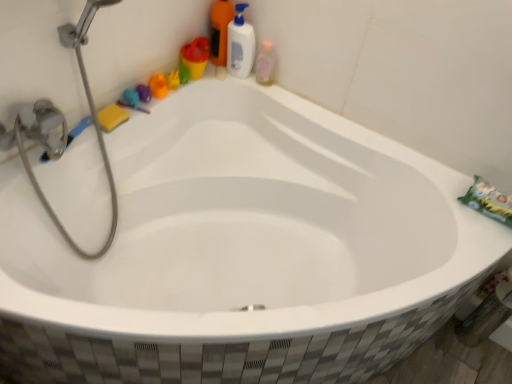
Question: Is rubber duck at upper left, placed as the 1th toy when sorted from left to right, next to rubber duck at upper left, the 2th toy in the right-to-left sequence?

Choices:
 (A) no
 (B) yes

Answer: (B)

Question: From a real-world perspective, is rubber duck at upper left, placed as the third toy when sorted from right to left, positioned over rubber duck at upper left, which is the second toy from left to right, based on gravity?

Choices:
 (A) no
 (B) yes

Answer: (A)

Question: Is rubber duck at upper left, placed as the third toy when sorted from right to left, oriented towards rubber duck at upper left, the 2th toy in the right-to-left sequence?

Choices:
 (A) no
 (B) yes

Answer: (A)

Question: Can we say rubber duck at upper left, placed as the 1th toy when sorted from left to right, lies outside rubber duck at upper left, which is the second toy from left to right?

Choices:
 (A) no
 (B) yes

Answer: (B)

Question: Is rubber duck at upper left, placed as the 1th toy when sorted from left to right, to the left of rubber duck at upper left, which is the second toy from left to right, from the viewer's perspective?

Choices:
 (A) no
 (B) yes

Answer: (B)

Question: Choose the correct answer: Is rubber duck at upper left, the 2th toy in the right-to-left sequence, inside yellow sponge at upper left or outside it?

Choices:
 (A) outside
 (B) inside

Answer: (A)

Question: In terms of height, does rubber duck at upper left, which is the second toy from left to right, look taller or shorter compared to yellow sponge at upper left?

Choices:
 (A) short
 (B) tall

Answer: (B)

Question: Based on their positions, is rubber duck at upper left, the 2th toy in the right-to-left sequence, located to the left or right of yellow sponge at upper left?

Choices:
 (A) right
 (B) left

Answer: (A)

Question: Based on their sizes in the image, would you say rubber duck at upper left, which is the second toy from left to right, is bigger or smaller than yellow sponge at upper left?

Choices:
 (A) big
 (B) small

Answer: (A)

Question: Considering the positions of rubber duck at upper left, which is the second toy from left to right, and pink translucent bottle at upper right in the image, is rubber duck at upper left, which is the second toy from left to right, taller or shorter than pink translucent bottle at upper right?

Choices:
 (A) short
 (B) tall

Answer: (A)

Question: Considering the relative positions of rubber duck at upper left, which is the second toy from left to right, and pink translucent bottle at upper right in the image provided, is rubber duck at upper left, which is the second toy from left to right, to the left or to the right of pink translucent bottle at upper right?

Choices:
 (A) left
 (B) right

Answer: (A)

Question: Is rubber duck at upper left, which is the second toy from left to right, in front of or behind pink translucent bottle at upper right in the image?

Choices:
 (A) front
 (B) behind

Answer: (A)

Question: Considering the positions of rubber duck at upper left, which is the second toy from left to right, and pink translucent bottle at upper right in the image, is rubber duck at upper left, which is the second toy from left to right, bigger or smaller than pink translucent bottle at upper right?

Choices:
 (A) small
 (B) big

Answer: (A)

Question: Is matte plastic cup at upper left bigger or smaller than translucent plastic bottle at upper right, the 1th cleaning product from the left?

Choices:
 (A) small
 (B) big

Answer: (A)

Question: Does point (204, 57) appear closer or farther from the camera than point (214, 34)?

Choices:
 (A) closer
 (B) farther

Answer: (B)